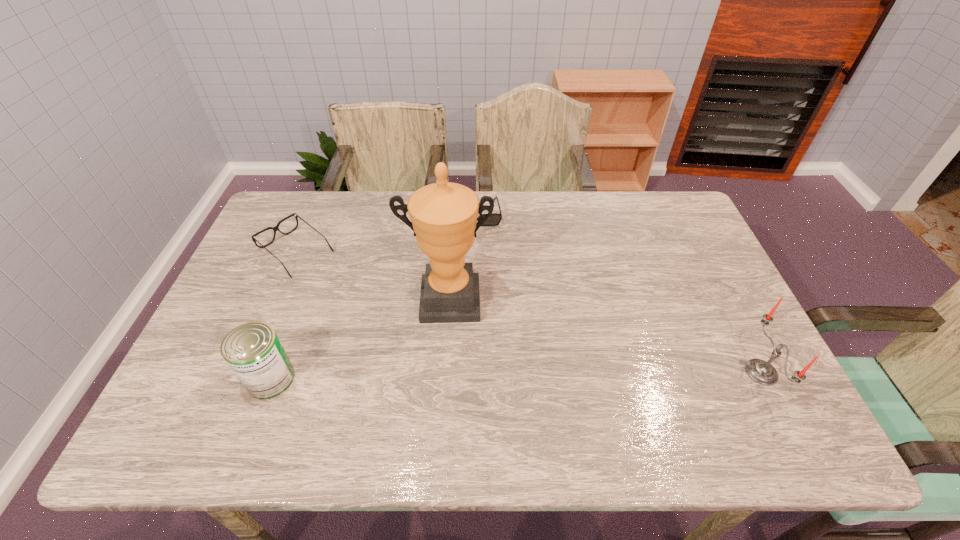
The image size is (960, 540). I want to click on free space located on the front-facing side of the sunglasses, so click(x=488, y=314).

The width and height of the screenshot is (960, 540). What are the coordinates of `vacant region located on the front-facing side of the sunglasses` in the screenshot? It's located at (484, 284).

In order to click on vacant space located on the front-facing side of the sunglasses in this screenshot , I will do `click(487, 308)`.

Locate an element on the screen. Image resolution: width=960 pixels, height=540 pixels. free spot located with the lenses facing outward on the spectacles is located at coordinates (382, 318).

Where is `vacant space located with the lenses facing outward on the spectacles`? This screenshot has width=960, height=540. vacant space located with the lenses facing outward on the spectacles is located at coordinates (334, 280).

Image resolution: width=960 pixels, height=540 pixels. Find the location of `free space located 0.200m with the lenses facing outward on the spectacles`. free space located 0.200m with the lenses facing outward on the spectacles is located at coordinates (363, 302).

This screenshot has height=540, width=960. Find the location of `vacant region located 0.220m at the front of the tallest object with handles`. vacant region located 0.220m at the front of the tallest object with handles is located at coordinates (447, 400).

Image resolution: width=960 pixels, height=540 pixels. Find the location of `blank space located at the front of the tallest object with handles`. blank space located at the front of the tallest object with handles is located at coordinates (448, 362).

The height and width of the screenshot is (540, 960). I want to click on free region located 0.130m at the front of the tallest object with handles, so click(448, 366).

Find the location of a particular element. sunglasses that is at the far edge is located at coordinates (494, 220).